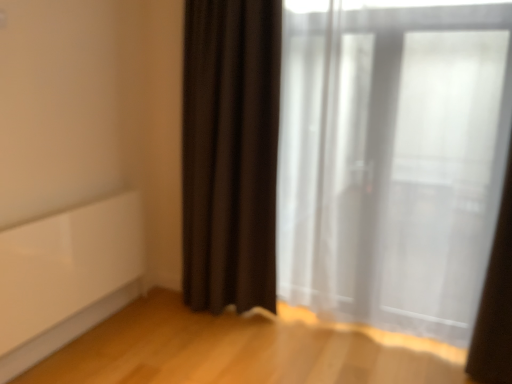
What is the approximate width of white sheer curtain at right, which is the second curtain in left-to-right order?

white sheer curtain at right, which is the second curtain in left-to-right order, is 9.43 inches in width.

Locate an element on the screen. The image size is (512, 384). white sheer curtain at right, which is the second curtain in left-to-right order is located at coordinates (496, 302).

What do you see at coordinates (496, 302) in the screenshot? I see `white sheer curtain at right, which is the second curtain in left-to-right order` at bounding box center [496, 302].

Describe the element at coordinates (392, 161) in the screenshot. I see `white sheer curtain at right, which is the 1th curtain from left to right` at that location.

What are the coordinates of `white sheer curtain at right, which is the 1th curtain from left to right` in the screenshot? It's located at (392, 161).

What are the coordinates of `white sheer curtain at right, the 1th curtain positioned from the right` in the screenshot? It's located at pos(496,302).

Does white sheer curtain at right, acting as the second curtain starting from the right, appear on the left side of white sheer curtain at right, the 1th curtain positioned from the right?

Yes.

In the image, is white sheer curtain at right, acting as the second curtain starting from the right, positioned in front of or behind white sheer curtain at right, which is the second curtain in left-to-right order?

white sheer curtain at right, acting as the second curtain starting from the right, is positioned farther from the viewer than white sheer curtain at right, which is the second curtain in left-to-right order.

Between point (325, 254) and point (478, 346), which one is positioned behind?

Positioned behind is point (325, 254).

From the image's perspective, which is above, white sheer curtain at right, acting as the second curtain starting from the right, or white sheer curtain at right, the 1th curtain positioned from the right?

white sheer curtain at right, acting as the second curtain starting from the right, is shown above in the image.

From a real-world perspective, which object rests below the other?

In real-world perspective, white sheer curtain at right, which is the second curtain in left-to-right order, is lower.

Is white sheer curtain at right, acting as the second curtain starting from the right, thinner than white sheer curtain at right, the 1th curtain positioned from the right?

Yes.

Considering the sizes of objects white sheer curtain at right, acting as the second curtain starting from the right, and white sheer curtain at right, the 1th curtain positioned from the right, in the image provided, who is shorter, white sheer curtain at right, acting as the second curtain starting from the right, or white sheer curtain at right, the 1th curtain positioned from the right,?

white sheer curtain at right, the 1th curtain positioned from the right, is shorter.

In terms of size, does white sheer curtain at right, acting as the second curtain starting from the right, appear bigger or smaller than white sheer curtain at right, which is the second curtain in left-to-right order?

Clearly, white sheer curtain at right, acting as the second curtain starting from the right, is larger in size than white sheer curtain at right, which is the second curtain in left-to-right order.

Is white sheer curtain at right, acting as the second curtain starting from the right, surrounding white sheer curtain at right, the 1th curtain positioned from the right?

Definitely not — white sheer curtain at right, the 1th curtain positioned from the right, is not inside white sheer curtain at right, acting as the second curtain starting from the right.

Based on the photo, is white sheer curtain at right, acting as the second curtain starting from the right, not near white sheer curtain at right, which is the second curtain in left-to-right order?

No.

Is white sheer curtain at right, acting as the second curtain starting from the right, aimed at white sheer curtain at right, the 1th curtain positioned from the right?

Yes.

Identify the location of curtain that appears behind the white sheer curtain at right, the 1th curtain positioned from the right. Image resolution: width=512 pixels, height=384 pixels. (392, 161).

Visually, is white sheer curtain at right, which is the second curtain in left-to-right order, positioned to the left or to the right of white sheer curtain at right, which is the 1th curtain from left to right?

From the image, it's evident that white sheer curtain at right, which is the second curtain in left-to-right order, is to the right of white sheer curtain at right, which is the 1th curtain from left to right.

Considering the positions of objects white sheer curtain at right, the 1th curtain positioned from the right, and white sheer curtain at right, acting as the second curtain starting from the right, in the image provided, who is in front, white sheer curtain at right, the 1th curtain positioned from the right, or white sheer curtain at right, acting as the second curtain starting from the right,?

Positioned in front is white sheer curtain at right, the 1th curtain positioned from the right.

Considering the positions of points (485, 292) and (421, 117), is point (485, 292) closer to camera compared to point (421, 117)?

Yes, it is in front of point (421, 117).

From the picture: From the image's perspective, between white sheer curtain at right, which is the second curtain in left-to-right order, and white sheer curtain at right, acting as the second curtain starting from the right, who is located below?

white sheer curtain at right, which is the second curtain in left-to-right order, is shown below in the image.

From a real-world perspective, does white sheer curtain at right, the 1th curtain positioned from the right, sit lower than white sheer curtain at right, acting as the second curtain starting from the right?

Indeed, from a real-world perspective, white sheer curtain at right, the 1th curtain positioned from the right, is positioned beneath white sheer curtain at right, acting as the second curtain starting from the right.

Considering the relative sizes of white sheer curtain at right, the 1th curtain positioned from the right, and white sheer curtain at right, which is the 1th curtain from left to right, in the image provided, is white sheer curtain at right, the 1th curtain positioned from the right, thinner than white sheer curtain at right, which is the 1th curtain from left to right,?

No, white sheer curtain at right, the 1th curtain positioned from the right, is not thinner than white sheer curtain at right, which is the 1th curtain from left to right.

Which of these two, white sheer curtain at right, which is the second curtain in left-to-right order, or white sheer curtain at right, which is the 1th curtain from left to right, stands taller?

white sheer curtain at right, which is the 1th curtain from left to right, is taller.

Considering the relative sizes of white sheer curtain at right, which is the second curtain in left-to-right order, and white sheer curtain at right, acting as the second curtain starting from the right, in the image provided, is white sheer curtain at right, which is the second curtain in left-to-right order, bigger than white sheer curtain at right, acting as the second curtain starting from the right,?

Incorrect, white sheer curtain at right, which is the second curtain in left-to-right order, is not larger than white sheer curtain at right, acting as the second curtain starting from the right.

Is white sheer curtain at right, the 1th curtain positioned from the right, positioned beyond the bounds of white sheer curtain at right, acting as the second curtain starting from the right?

Yes, white sheer curtain at right, the 1th curtain positioned from the right, is not within white sheer curtain at right, acting as the second curtain starting from the right.

Is white sheer curtain at right, which is the second curtain in left-to-right order, far from white sheer curtain at right, acting as the second curtain starting from the right?

They are positioned close to each other.

Is white sheer curtain at right, which is the second curtain in left-to-right order, positioned with its back to white sheer curtain at right, acting as the second curtain starting from the right?

white sheer curtain at right, which is the second curtain in left-to-right order, does not have its back to white sheer curtain at right, acting as the second curtain starting from the right.

What's the angular difference between white sheer curtain at right, which is the second curtain in left-to-right order, and white sheer curtain at right, which is the 1th curtain from left to right,'s facing directions?

white sheer curtain at right, which is the second curtain in left-to-right order, and white sheer curtain at right, which is the 1th curtain from left to right, are facing 1.81 degrees away from each other.

How far apart are white sheer curtain at right, which is the second curtain in left-to-right order, and white sheer curtain at right, which is the 1th curtain from left to right?

white sheer curtain at right, which is the second curtain in left-to-right order, and white sheer curtain at right, which is the 1th curtain from left to right, are 22.12 inches apart from each other.

Find the location of a particular element. curtain above the white sheer curtain at right, which is the second curtain in left-to-right order (from a real-world perspective) is located at coordinates (392, 161).

Where is `curtain on the right of white sheer curtain at right, which is the 1th curtain from left to right`? The height and width of the screenshot is (384, 512). curtain on the right of white sheer curtain at right, which is the 1th curtain from left to right is located at coordinates (496, 302).

Identify the location of curtain lying below the white sheer curtain at right, which is the 1th curtain from left to right (from the image's perspective). Image resolution: width=512 pixels, height=384 pixels. (496, 302).